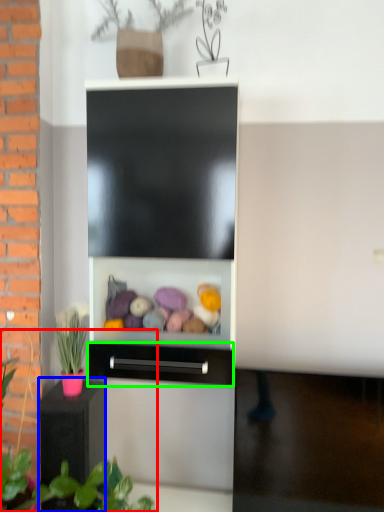
Question: Based on their relative distances, which object is farther from plant (highlighted by a red box)? Choose from furniture (highlighted by a blue box) and drawer (highlighted by a green box).

Choices:
 (A) furniture
 (B) drawer

Answer: (B)